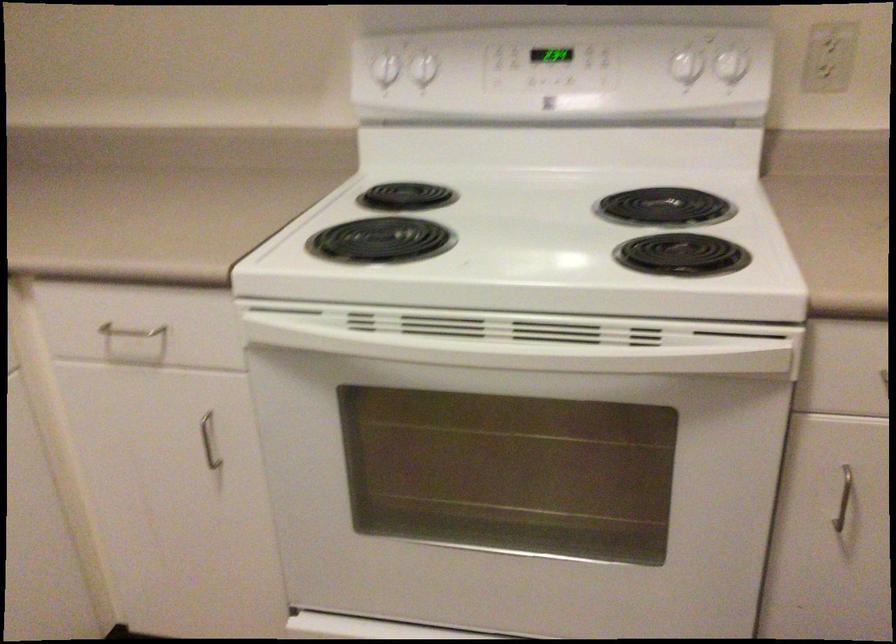
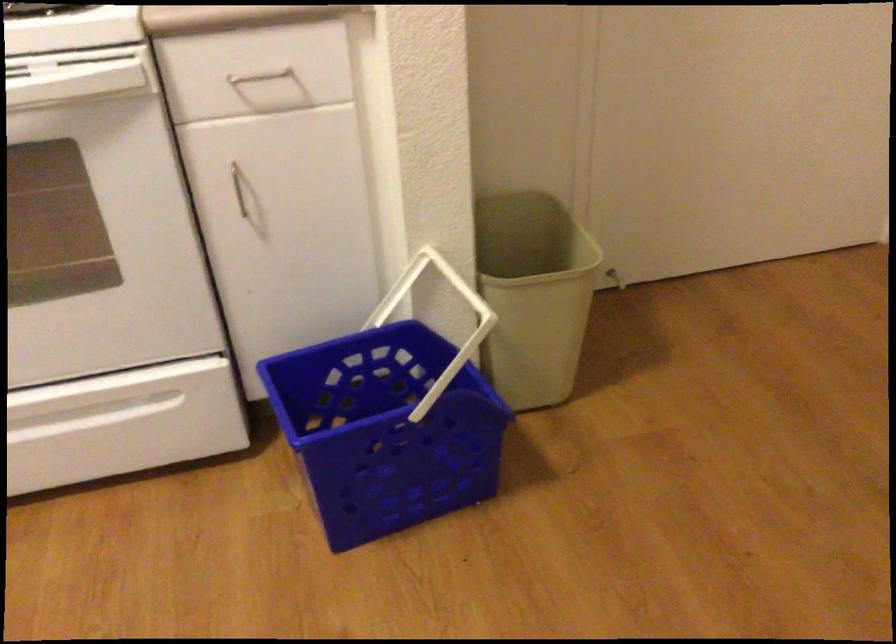
In a continuous first-person perspective shot, in which direction is the camera moving?

The movement direction of the cameraman is right, backward.